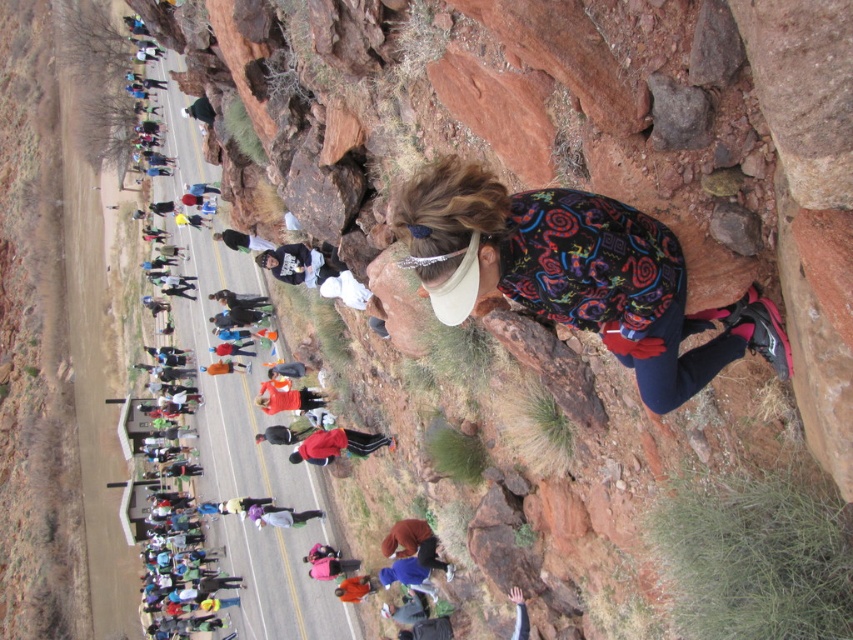
From the picture: Can you confirm if multicolored fabric at upper right is positioned to the left of smooth dirt road at center?

In fact, multicolored fabric at upper right is to the right of smooth dirt road at center.

Between multicolored fabric at upper right and smooth dirt road at center, which one appears on the left side from the viewer's perspective?

smooth dirt road at center

Find the location of `multicolored fabric at upper right`. multicolored fabric at upper right is located at coordinates (575, 273).